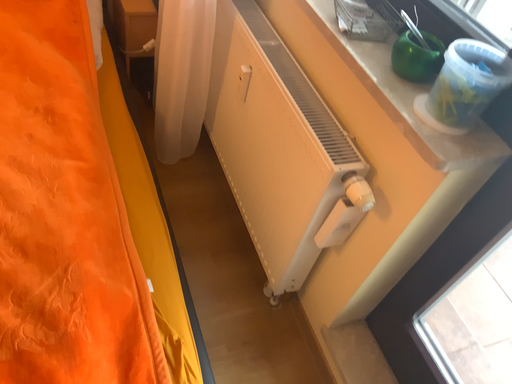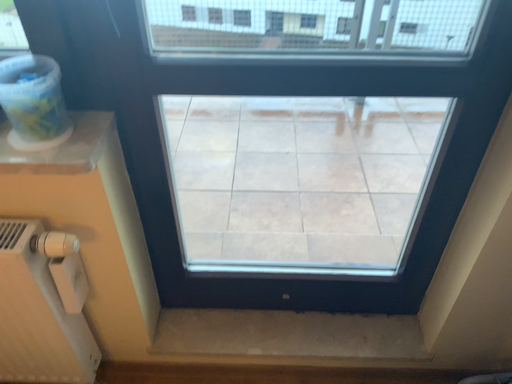
Question: How did the camera likely rotate when shooting the video?

Choices:
 (A) rotated downward
 (B) rotated upward

Answer: (B)